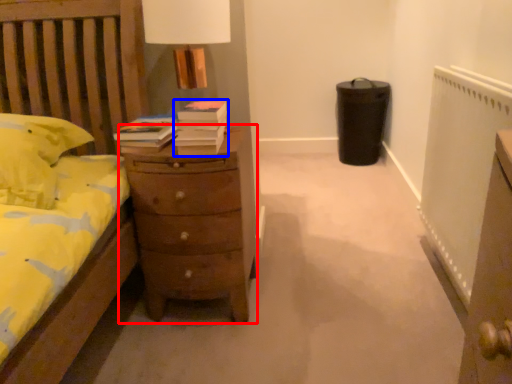
Question: Which object is closer to the camera taking this photo, chest of drawers (highlighted by a red box) or book (highlighted by a blue box)?

Choices:
 (A) chest of drawers
 (B) book

Answer: (B)